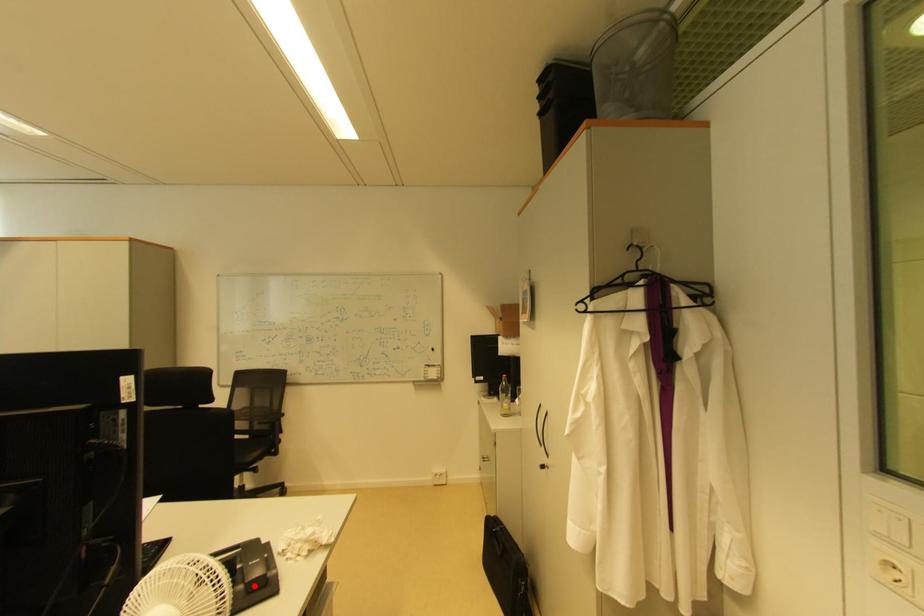
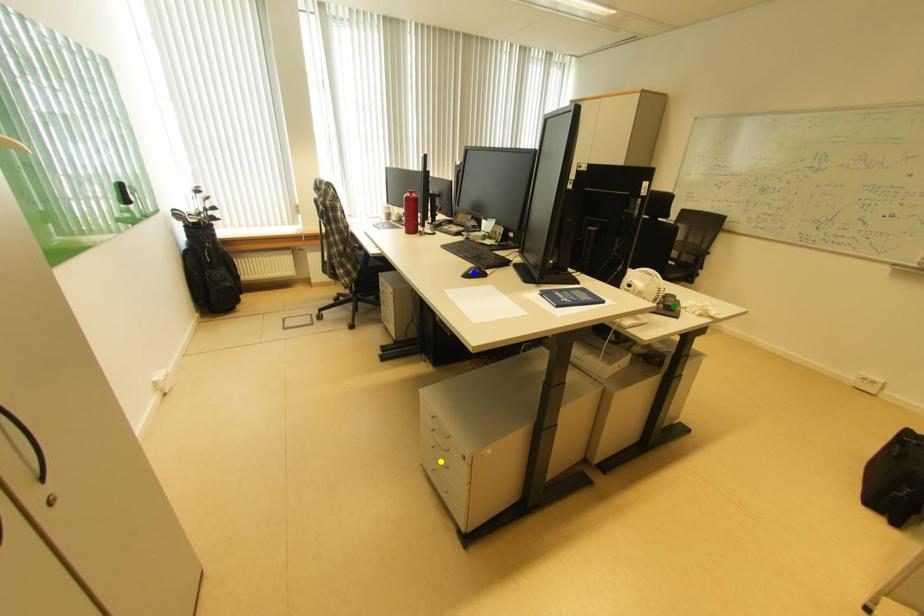
Question: I am providing you with two images of the same scene from different viewpoints. A red point is marked on the first image. You are given multiple points on the second image. Can you choose the point in image 2 that corresponds to the point in image 1?

Choices:
 (A) green point
 (B) blue point
 (C) yellow point

Answer: (A)